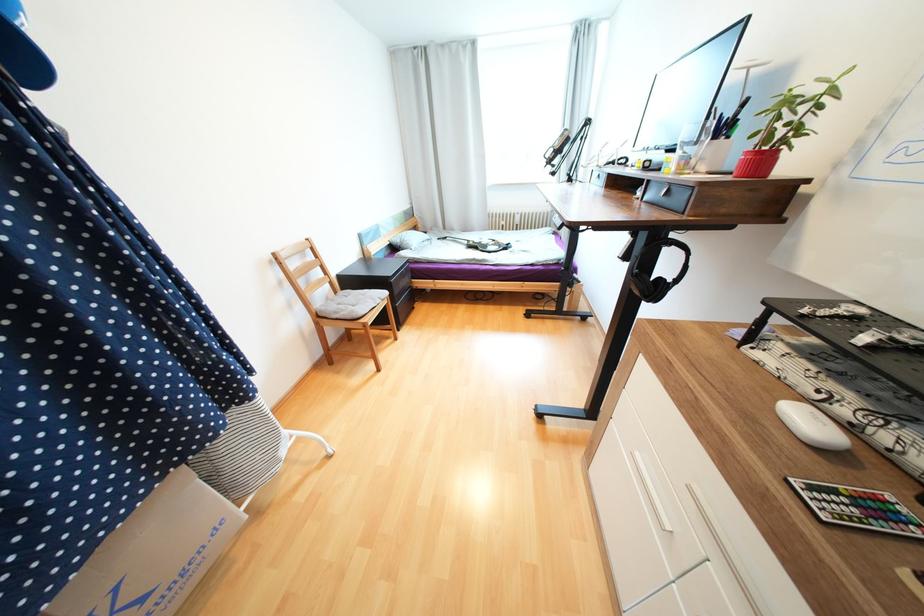
Where is `chair sitting surface`? Image resolution: width=924 pixels, height=616 pixels. chair sitting surface is located at coordinates (346, 305).